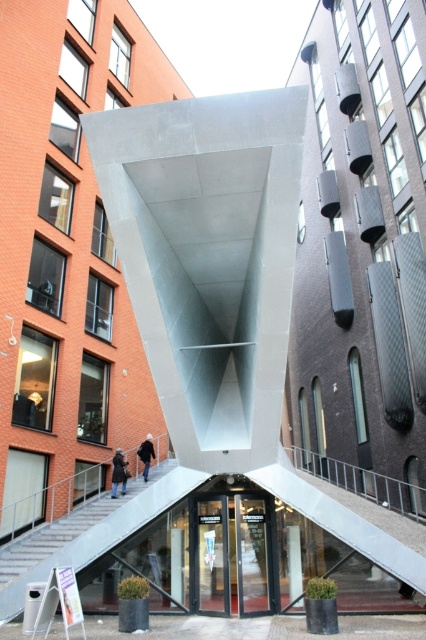
Question: Where is transparent glass door at center located in relation to black matte jacket at lower left in the image?

Choices:
 (A) below
 (B) above

Answer: (A)

Question: Among these objects, which one is farthest from the camera?

Choices:
 (A) metallic gray escalator at lower center
 (B) black matte jacket at lower left
 (C) transparent glass door at center

Answer: (B)

Question: Which is farther from the metallic gray escalator at lower center?

Choices:
 (A) black matte jacket at lower left
 (B) dark gray coat at lower left

Answer: (A)

Question: Does transparent glass door at center have a larger size compared to dark gray coat at lower left?

Choices:
 (A) no
 (B) yes

Answer: (B)

Question: Can you confirm if transparent glass door at center is bigger than black matte jacket at lower left?

Choices:
 (A) no
 (B) yes

Answer: (B)

Question: Among these objects, which one is nearest to the camera?

Choices:
 (A) dark gray coat at lower left
 (B) metallic gray escalator at lower center
 (C) black matte jacket at lower left

Answer: (B)